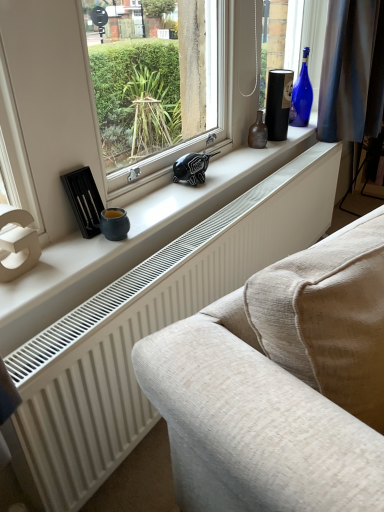
Measure the distance between point (x=309, y=97) and camera.

Point (x=309, y=97) is 7.31 feet away from camera.

What are the coordinates of `white matte window sill at center` in the screenshot? It's located at (132, 239).

Considering the relative sizes of brown glass bottle at center, positioned as the second bottle in right-to-left order, and white textured radiator at lower center in the image provided, is brown glass bottle at center, positioned as the second bottle in right-to-left order, bigger than white textured radiator at lower center?

No, brown glass bottle at center, positioned as the second bottle in right-to-left order, is not bigger than white textured radiator at lower center.

From a real-world perspective, is brown glass bottle at center, placed as the 1th bottle when sorted from bottom to top, located beneath white textured radiator at lower center?

No.

Who is shorter, brown glass bottle at center, the first bottle from the front, or white textured radiator at lower center?

brown glass bottle at center, the first bottle from the front, is shorter.

From the image's perspective, between brown glass bottle at center, the 2th bottle in the back-to-front sequence, and white textured radiator at lower center, who is located below?

white textured radiator at lower center, from the image's perspective.

From a real-world perspective, is white textured radiator at lower center positioned over blue glass bottle at upper right, which appears as the 2th bottle when ordered from the bottom, based on gravity?

Actually, white textured radiator at lower center is physically below blue glass bottle at upper right, which appears as the 2th bottle when ordered from the bottom, in the real world.

Which is behind, point (101, 331) or point (292, 101)?

The point (292, 101) is farther from the camera.

What's the angular difference between white textured radiator at lower center and blue glass bottle at upper right, the 2th bottle in the front-to-back sequence,'s facing directions?

white textured radiator at lower center and blue glass bottle at upper right, the 2th bottle in the front-to-back sequence, are facing 3.98 degrees away from each other.

Is blue glass bottle at upper right, which ranks as the 1th bottle in right-to-left order, at the back of white textured radiator at lower center?

No, white textured radiator at lower center is not facing the opposite direction of blue glass bottle at upper right, which ranks as the 1th bottle in right-to-left order.

Which is behind, point (305, 61) or point (8, 296)?

The point (305, 61) is behind.

From the picture: Is blue glass bottle at upper right, the 1th bottle in the back-to-front sequence, oriented away from white matte window sill at center?

No, blue glass bottle at upper right, the 1th bottle in the back-to-front sequence,'s orientation is not away from white matte window sill at center.

From the image's perspective, does blue glass bottle at upper right, the 1th bottle in the back-to-front sequence, appear higher than white matte window sill at center?

Yes.

Who is bigger, blue glass bottle at upper right, positioned as the first bottle in top-to-bottom order, or white matte window sill at center?

white matte window sill at center is bigger.

Can you confirm if brown glass bottle at center, the 2th bottle in the back-to-front sequence, is positioned to the right of blue glass bottle at upper right, which appears as the 2th bottle when ordered from the bottom?

No.

Consider the image. Can you confirm if brown glass bottle at center, positioned as the second bottle in right-to-left order, is shorter than blue glass bottle at upper right, the 2th bottle from the left?

Correct, brown glass bottle at center, positioned as the second bottle in right-to-left order, is not as tall as blue glass bottle at upper right, the 2th bottle from the left.

Is blue glass bottle at upper right, the 2th bottle from the left, completely or partially inside brown glass bottle at center, arranged as the 2th bottle when viewed from the top?

No.

From the image's perspective, between brown glass bottle at center, arranged as the 2th bottle when viewed from the top, and blue glass bottle at upper right, which appears as the 2th bottle when ordered from the bottom, which one is located above?

blue glass bottle at upper right, which appears as the 2th bottle when ordered from the bottom, from the image's perspective.

Is white matte window sill at center closer to camera compared to brown glass bottle at center, arranged as the 2th bottle when viewed from the top?

Yes, white matte window sill at center is closer to the camera.

Considering the sizes of white matte window sill at center and brown glass bottle at center, placed as the 1th bottle when sorted from bottom to top, in the image, is white matte window sill at center taller or shorter than brown glass bottle at center, placed as the 1th bottle when sorted from bottom to top,?

white matte window sill at center is shorter than brown glass bottle at center, placed as the 1th bottle when sorted from bottom to top.

Consider the image. Considering the relative positions of white matte window sill at center and brown glass bottle at center, the 1th bottle in the left-to-right sequence, in the image provided, is white matte window sill at center to the right of brown glass bottle at center, the 1th bottle in the left-to-right sequence, from the viewer's perspective?

No, white matte window sill at center is not to the right of brown glass bottle at center, the 1th bottle in the left-to-right sequence.

From the image's perspective, is white matte window sill at center located beneath brown glass bottle at center, positioned as the second bottle in right-to-left order?

Yes, from the image's perspective, white matte window sill at center is below brown glass bottle at center, positioned as the second bottle in right-to-left order.

How much distance is there between blue glass bottle at upper right, which ranks as the 1th bottle in right-to-left order, and white textured radiator at lower center?

37.32 inches.

Considering the positions of objects blue glass bottle at upper right, the 2th bottle in the front-to-back sequence, and white textured radiator at lower center in the image provided, who is more to the left, blue glass bottle at upper right, the 2th bottle in the front-to-back sequence, or white textured radiator at lower center?

white textured radiator at lower center.

Which is behind, point (303, 85) or point (35, 412)?

Point (303, 85)

In the image, is blue glass bottle at upper right, the 2th bottle in the front-to-back sequence, positioned in front of or behind white textured radiator at lower center?

blue glass bottle at upper right, the 2th bottle in the front-to-back sequence, is positioned farther from the viewer than white textured radiator at lower center.

Does blue glass bottle at upper right, positioned as the first bottle in top-to-bottom order, have a smaller size compared to brown glass bottle at center, arranged as the 2th bottle when viewed from the top?

No, blue glass bottle at upper right, positioned as the first bottle in top-to-bottom order, is not smaller than brown glass bottle at center, arranged as the 2th bottle when viewed from the top.

Is blue glass bottle at upper right, the 2th bottle from the left, completely or partially outside of brown glass bottle at center, positioned as the second bottle in right-to-left order?

Yes, blue glass bottle at upper right, the 2th bottle from the left, is not within brown glass bottle at center, positioned as the second bottle in right-to-left order.

The image size is (384, 512). What are the coordinates of `bottle that is the 1st object located behind the white textured radiator at lower center` in the screenshot? It's located at (258, 133).

I want to click on the 2nd bottle above the white textured radiator at lower center (from the image's perspective), so click(x=301, y=95).

Estimate the real-world distances between objects in this image. Which object is closer to white matte window sill at center, white textured radiator at lower center or blue glass bottle at upper right, which ranks as the 1th bottle in right-to-left order?

Based on the image, white textured radiator at lower center appears to be nearer to white matte window sill at center.

Considering their positions, is white textured radiator at lower center positioned further to brown glass bottle at center, the 2th bottle in the back-to-front sequence, than white matte window sill at center?

white textured radiator at lower center is positioned further to the anchor brown glass bottle at center, the 2th bottle in the back-to-front sequence.

When comparing their distances from brown glass bottle at center, positioned as the second bottle in right-to-left order, does white matte window sill at center or white textured radiator at lower center seem further?

white textured radiator at lower center is positioned further to the anchor brown glass bottle at center, positioned as the second bottle in right-to-left order.

Which object lies further to the anchor point brown glass bottle at center, arranged as the 2th bottle when viewed from the top, blue glass bottle at upper right, the 2th bottle from the left, or white matte window sill at center?

white matte window sill at center.

Which object lies further to the anchor point white textured radiator at lower center, brown glass bottle at center, the first bottle from the front, or white matte window sill at center?

Among the two, brown glass bottle at center, the first bottle from the front, is located further to white textured radiator at lower center.

From the image, which object appears to be nearer to white matte window sill at center, brown glass bottle at center, the first bottle from the front, or white textured radiator at lower center?

white textured radiator at lower center is positioned closer to the anchor white matte window sill at center.

In the scene shown: Based on their spatial positions, is blue glass bottle at upper right, positioned as the first bottle in top-to-bottom order, or white textured radiator at lower center closer to white matte window sill at center?

Based on the image, white textured radiator at lower center appears to be nearer to white matte window sill at center.

When comparing their distances from blue glass bottle at upper right, the 2th bottle from the left, does brown glass bottle at center, the 2th bottle in the back-to-front sequence, or white matte window sill at center seem further?

white matte window sill at center.

In order to click on window sill positioned between white textured radiator at lower center and brown glass bottle at center, the 1th bottle in the left-to-right sequence, from near to far in this screenshot , I will do `click(132, 239)`.

Where is `window sill between white textured radiator at lower center and blue glass bottle at upper right, the 2th bottle from the left, along the z-axis`? This screenshot has width=384, height=512. window sill between white textured radiator at lower center and blue glass bottle at upper right, the 2th bottle from the left, along the z-axis is located at coordinates (132, 239).

Where is `bottle positioned between white textured radiator at lower center and blue glass bottle at upper right, which appears as the 2th bottle when ordered from the bottom, from near to far`? bottle positioned between white textured radiator at lower center and blue glass bottle at upper right, which appears as the 2th bottle when ordered from the bottom, from near to far is located at coordinates (258, 133).

This screenshot has height=512, width=384. What are the coordinates of `bottle between white matte window sill at center and blue glass bottle at upper right, which ranks as the 1th bottle in right-to-left order, from front to back` in the screenshot? It's located at (258, 133).